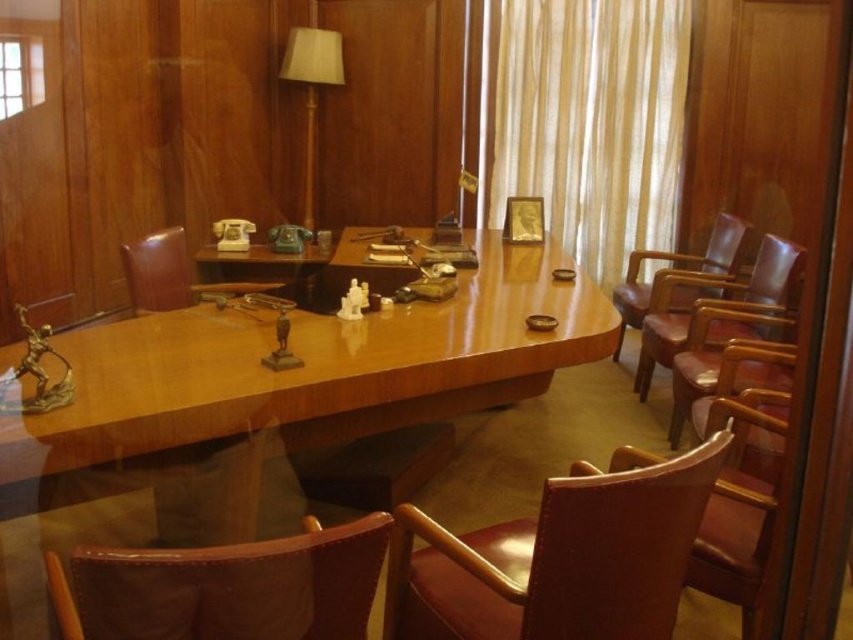
Does brown leather chair at right have a lesser height compared to brown leather armchair at right?

Correct, brown leather chair at right is not as tall as brown leather armchair at right.

Between brown leather chair at right and brown leather armchair at right, which one has more height?

brown leather armchair at right

Locate an element on the screen. The image size is (853, 640). brown leather chair at right is located at coordinates (721, 304).

Between leather at lower left and brown leather chair at right, which one appears on the right side from the viewer's perspective?

brown leather chair at right is more to the right.

The height and width of the screenshot is (640, 853). In order to click on leather at lower left in this screenshot , I will do `click(225, 588)`.

Which is behind, point (293, 547) or point (646, 364)?

The point (646, 364) is behind.

Image resolution: width=853 pixels, height=640 pixels. What are the coordinates of `leather at lower left` in the screenshot? It's located at (225, 588).

Describe the element at coordinates (265, 406) in the screenshot. I see `wooden table at center` at that location.

Which is more to the right, wooden table at center or leather at lower left?

wooden table at center is more to the right.

Where is `wooden table at center`? This screenshot has width=853, height=640. wooden table at center is located at coordinates (265, 406).